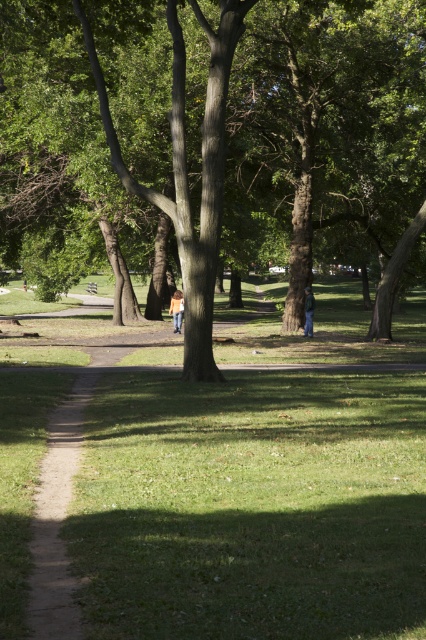
Who is more distant from viewer, (141, 428) or (94, 292)?

The point (94, 292) is behind.

Can you confirm if green grass at center is taller than wooden park bench at center?

Yes, green grass at center is taller than wooden park bench at center.

You are a GUI agent. You are given a task and a screenshot of the screen. Output one action in this format:
    pyautogui.click(x=<x>, y=<y>)
    Task: Click on the green grass at center
    
    Given the screenshot: What is the action you would take?
    pyautogui.click(x=252, y=508)

Between green leafy tree at center and blue fabric jacket at lower center, which one is positioned higher?

green leafy tree at center

Who is positioned more to the right, green leafy tree at center or blue fabric jacket at lower center?

blue fabric jacket at lower center

The width and height of the screenshot is (426, 640). What do you see at coordinates (213, 141) in the screenshot? I see `green leafy tree at center` at bounding box center [213, 141].

Find the location of a particular element. green leafy tree at center is located at coordinates (213, 141).

Is orange fabric jacket at center below wooden park bench at center?

Yes.

Is orange fabric jacket at center taller than wooden park bench at center?

Correct, orange fabric jacket at center is much taller as wooden park bench at center.

Is point (173, 296) in front of point (92, 284)?

That is True.

At what (x,y) coordinates should I click in order to perform the action: click on orange fabric jacket at center. Please return your answer as a coordinate pair (x, y). The height and width of the screenshot is (640, 426). Looking at the image, I should click on (176, 308).